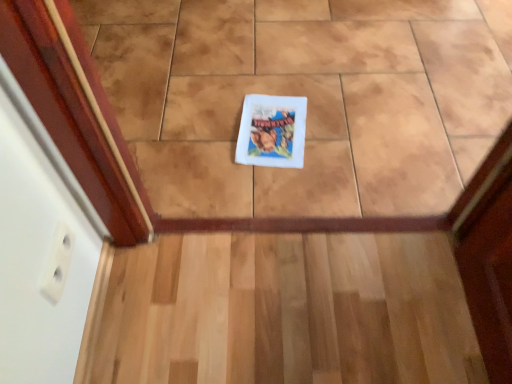
Question: Considering the positions of light wood stairs at center and white matte book cover at center in the image, is light wood stairs at center wider or thinner than white matte book cover at center?

Choices:
 (A) wide
 (B) thin

Answer: (A)

Question: From their relative heights in the image, would you say light wood stairs at center is taller or shorter than white matte book cover at center?

Choices:
 (A) tall
 (B) short

Answer: (B)

Question: Is point (380, 261) positioned closer to the camera than point (258, 130)?

Choices:
 (A) closer
 (B) farther

Answer: (A)

Question: In terms of height, does white matte book cover at center look taller or shorter compared to light wood stairs at center?

Choices:
 (A) short
 (B) tall

Answer: (B)

Question: Is white matte book cover at center bigger or smaller than light wood stairs at center?

Choices:
 (A) small
 (B) big

Answer: (A)

Question: Is white matte book cover at center situated inside light wood stairs at center or outside?

Choices:
 (A) outside
 (B) inside

Answer: (A)

Question: In the image, is white matte book cover at center positioned in front of or behind light wood stairs at center?

Choices:
 (A) behind
 (B) front

Answer: (A)